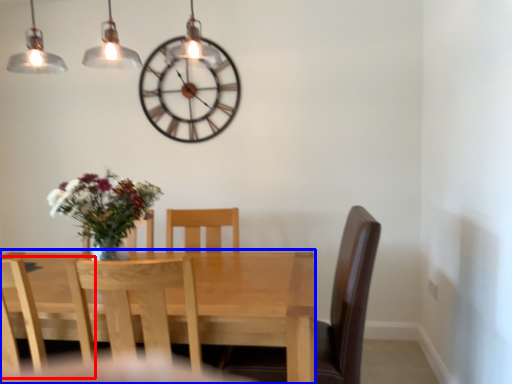
Question: Which object appears farthest to the camera in this image, chair (highlighted by a red box) or kitchen & dining room table (highlighted by a blue box)?

Choices:
 (A) chair
 (B) kitchen & dining room table

Answer: (A)